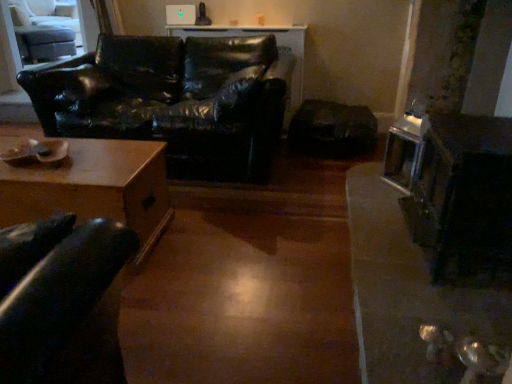
Question: Is light gray fabric swivel chair at upper left inside metallic silver fireplace at right?

Choices:
 (A) no
 (B) yes

Answer: (A)

Question: Is metallic silver fireplace at right at the right side of light gray fabric swivel chair at upper left?

Choices:
 (A) yes
 (B) no

Answer: (A)

Question: Can you confirm if metallic silver fireplace at right is smaller than light gray fabric swivel chair at upper left?

Choices:
 (A) yes
 (B) no

Answer: (B)

Question: Considering the relative positions of metallic silver fireplace at right and light gray fabric swivel chair at upper left in the image provided, is metallic silver fireplace at right to the left of light gray fabric swivel chair at upper left from the viewer's perspective?

Choices:
 (A) yes
 (B) no

Answer: (B)

Question: Does metallic silver fireplace at right lie behind light gray fabric swivel chair at upper left?

Choices:
 (A) no
 (B) yes

Answer: (A)

Question: Choose the correct answer: Is black leather couch at left inside metallic silver fireplace at right or outside it?

Choices:
 (A) outside
 (B) inside

Answer: (A)

Question: Considering the positions of black leather couch at left and metallic silver fireplace at right in the image, is black leather couch at left wider or thinner than metallic silver fireplace at right?

Choices:
 (A) wide
 (B) thin

Answer: (A)

Question: From the image's perspective, relative to metallic silver fireplace at right, is black leather couch at left above or below?

Choices:
 (A) above
 (B) below

Answer: (A)

Question: Does point (234, 142) appear closer or farther from the camera than point (458, 142)?

Choices:
 (A) closer
 (B) farther

Answer: (B)

Question: From a real-world perspective, is light gray fabric swivel chair at upper left physically located above or below metallic silver fireplace at right?

Choices:
 (A) below
 (B) above

Answer: (B)

Question: Considering their positions, is light gray fabric swivel chair at upper left located in front of or behind metallic silver fireplace at right?

Choices:
 (A) behind
 (B) front

Answer: (A)

Question: Is light gray fabric swivel chair at upper left inside the boundaries of metallic silver fireplace at right, or outside?

Choices:
 (A) outside
 (B) inside

Answer: (A)

Question: Considering the relative positions of light gray fabric swivel chair at upper left and metallic silver fireplace at right in the image provided, is light gray fabric swivel chair at upper left to the left or to the right of metallic silver fireplace at right?

Choices:
 (A) right
 (B) left

Answer: (B)

Question: Is light gray fabric swivel chair at upper left bigger or smaller than black leather couch at left?

Choices:
 (A) big
 (B) small

Answer: (B)

Question: From the image's perspective, is light gray fabric swivel chair at upper left positioned above or below black leather couch at left?

Choices:
 (A) above
 (B) below

Answer: (A)